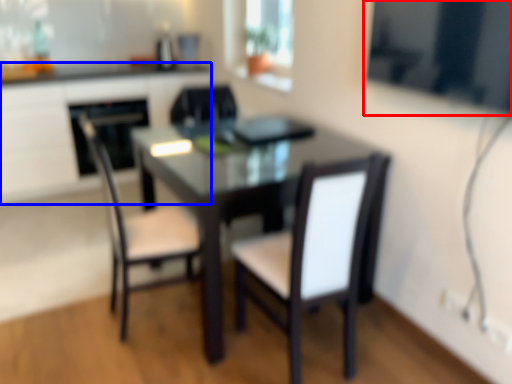
Question: Among these objects, which one is nearest to the camera, window screen (highlighted by a red box) or computer desk (highlighted by a blue box)?

Choices:
 (A) window screen
 (B) computer desk

Answer: (A)